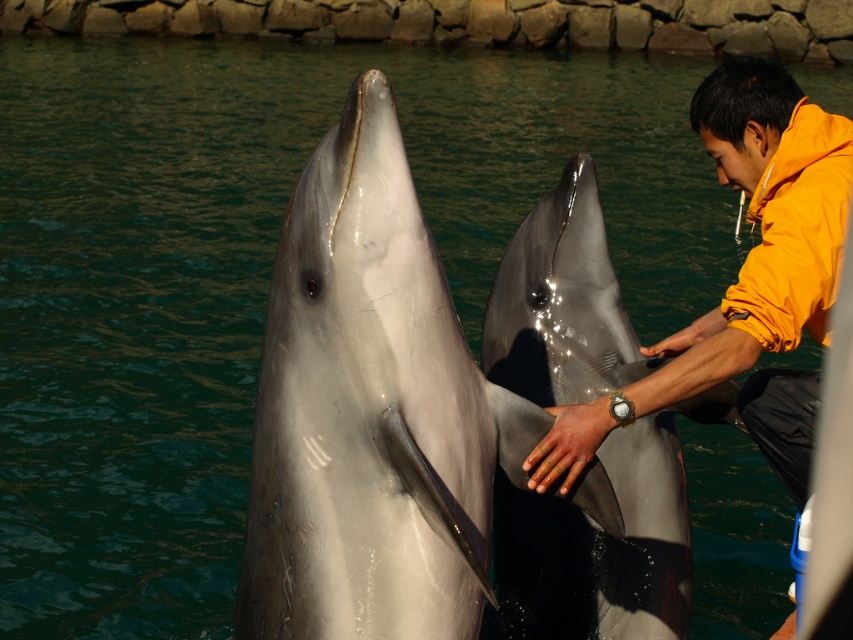
The height and width of the screenshot is (640, 853). What do you see at coordinates (370, 413) in the screenshot?
I see `white glossy dolphin at center` at bounding box center [370, 413].

How much distance is there between white glossy dolphin at center and glossy gray dolphin at center?

white glossy dolphin at center and glossy gray dolphin at center are 60.98 centimeters apart from each other.

At what (x,y) coordinates should I click in order to perform the action: click on white glossy dolphin at center. Please return your answer as a coordinate pair (x, y). Looking at the image, I should click on (370, 413).

The width and height of the screenshot is (853, 640). Identify the location of white glossy dolphin at center. (370, 413).

Can you confirm if yellow matte jacket at upper right is positioned to the left of yellow fleece jacket at right?

Indeed, yellow matte jacket at upper right is positioned on the left side of yellow fleece jacket at right.

Which of these two, yellow matte jacket at upper right or yellow fleece jacket at right, stands shorter?

yellow fleece jacket at right

Who is more forward, (x=792, y=220) or (x=764, y=332)?

Point (x=764, y=332) is in front.

Where is `yellow matte jacket at upper right`? yellow matte jacket at upper right is located at coordinates (746, 257).

From the picture: Is white glossy dolphin at center below yellow fleece jacket at right?

Yes, white glossy dolphin at center is below yellow fleece jacket at right.

Between white glossy dolphin at center and yellow fleece jacket at right, which one is positioned higher?

yellow fleece jacket at right is higher up.

What do you see at coordinates (370, 413) in the screenshot? I see `white glossy dolphin at center` at bounding box center [370, 413].

The width and height of the screenshot is (853, 640). In order to click on white glossy dolphin at center in this screenshot , I will do `click(370, 413)`.